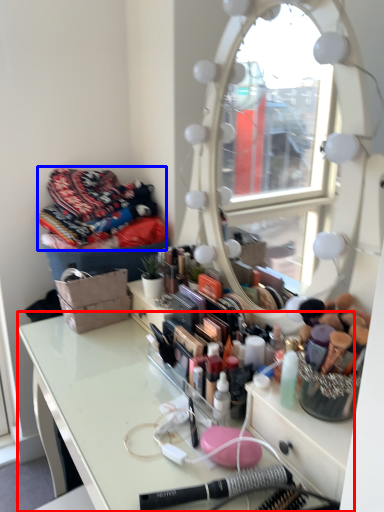
Question: Which of the following is the farthest to the observer, table (highlighted by a red box) or clothing (highlighted by a blue box)?

Choices:
 (A) table
 (B) clothing

Answer: (B)